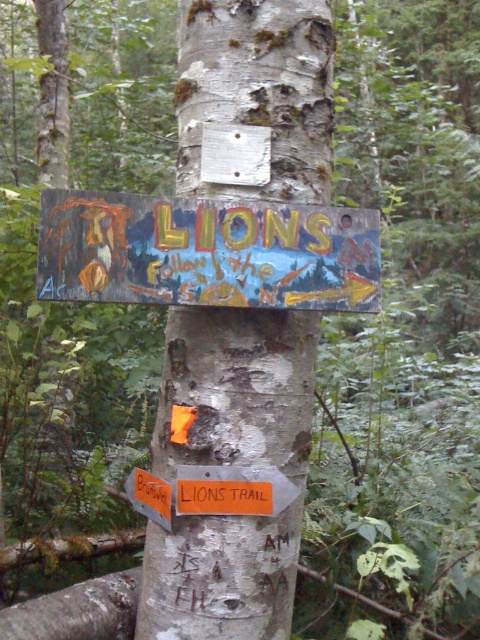
You are a hiker trying to read the wooden painted signboard at center. Can you see the white rough bark at center behind it?

Yes, the wooden painted signboard at center is above the white rough bark at center, so the white rough bark at center is visible behind it.

You are a hiker trying to read the wooden painted signboard at center. Since the white rough bark at center is blocking your view, can you move closer to see the signboard better?

The wooden painted signboard at center is smaller than the white rough bark at center, so moving closer might help you see the signboard better despite the bark blocking your view.